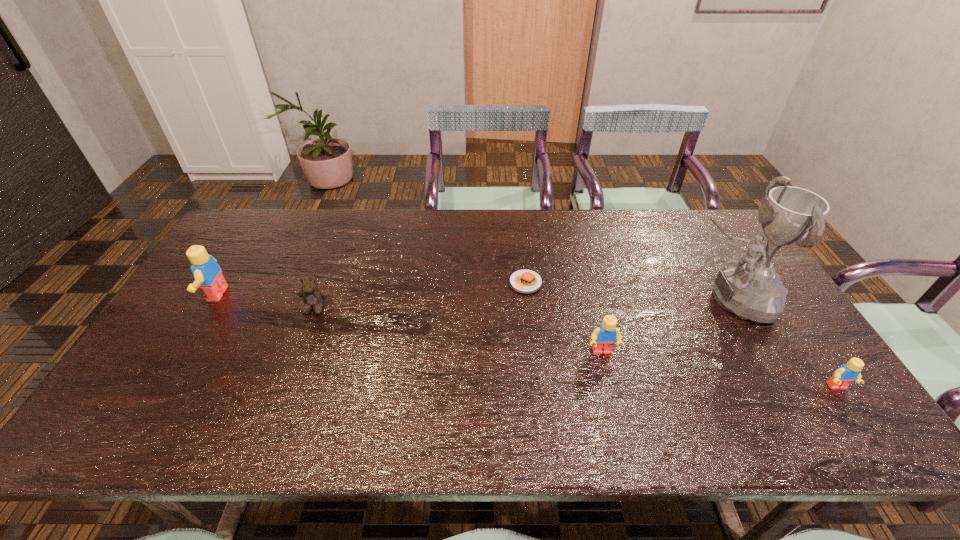
The height and width of the screenshot is (540, 960). I want to click on object situated at the near right corner, so click(x=844, y=375).

Where is `vacant space at the far edge`? This screenshot has width=960, height=540. vacant space at the far edge is located at coordinates (537, 212).

I want to click on vacant space at the near edge, so click(372, 380).

You are a GUI agent. You are given a task and a screenshot of the screen. Output one action in this format:
    pyautogui.click(x=<x>, y=<y>)
    Task: Click on the free space at the left edge of the desktop
    This screenshot has width=960, height=540.
    Given the screenshot: What is the action you would take?
    pyautogui.click(x=159, y=369)

In the image, there is a desktop. At what (x,y) coordinates should I click in order to perform the action: click on vacant area at the far right corner. Please return your answer as a coordinate pair (x, y). This screenshot has width=960, height=540. Looking at the image, I should click on (677, 219).

Identify the location of vacant area that lies between the tallest Lego and the nearest Lego. The height and width of the screenshot is (540, 960). (526, 340).

Locate an element on the screen. This screenshot has height=540, width=960. free point between the fourth object from left to right and the shortest object is located at coordinates (564, 318).

You are a GUI agent. You are given a task and a screenshot of the screen. Output one action in this format:
    pyautogui.click(x=<x>, y=<y>)
    Task: Click on the vacant area that lies between the fifth object from right to left and the third object from left to right
    Image resolution: width=960 pixels, height=540 pixels.
    Given the screenshot: What is the action you would take?
    pyautogui.click(x=420, y=295)

Identify the location of free space between the teddy bear and the nearest object. (576, 347).

Identify the location of free spot between the fourth object from left to right and the second tallest object. This screenshot has height=540, width=960. (409, 323).